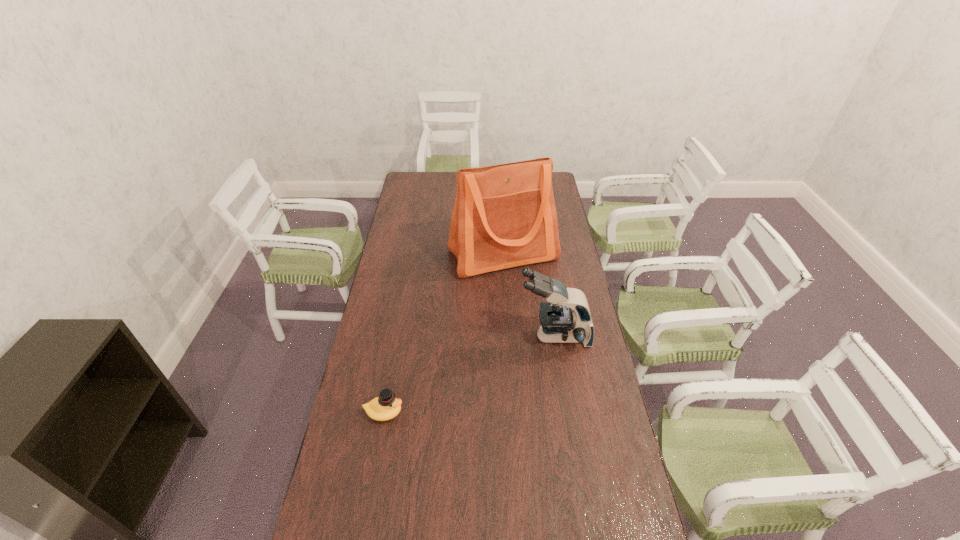
Locate an element on the screen. The height and width of the screenshot is (540, 960). the farthest object is located at coordinates (504, 216).

The width and height of the screenshot is (960, 540). In order to click on shopping bag in this screenshot , I will do `click(504, 216)`.

Image resolution: width=960 pixels, height=540 pixels. Find the location of `the second nearest object`. the second nearest object is located at coordinates (566, 317).

Find the location of a particular element. Image resolution: width=960 pixels, height=540 pixels. microscope is located at coordinates (566, 317).

The height and width of the screenshot is (540, 960). In order to click on the leftmost object in this screenshot , I will do `click(385, 407)`.

You are a GUI agent. You are given a task and a screenshot of the screen. Output one action in this format:
    pyautogui.click(x=<x>, y=<y>)
    Task: Click on the shortest object
    The width and height of the screenshot is (960, 540).
    Given the screenshot: What is the action you would take?
    pyautogui.click(x=385, y=407)

Where is `blank space located on the right of the shopping bag`? blank space located on the right of the shopping bag is located at coordinates (574, 255).

This screenshot has width=960, height=540. I want to click on vacant area located through the eyepieces of the microscope, so click(x=444, y=336).

This screenshot has height=540, width=960. I want to click on free region located 0.360m through the eyepieces of the microscope, so click(x=423, y=336).

The width and height of the screenshot is (960, 540). Find the location of `vacant region located 0.210m through the eyepieces of the microscope`. vacant region located 0.210m through the eyepieces of the microscope is located at coordinates (463, 336).